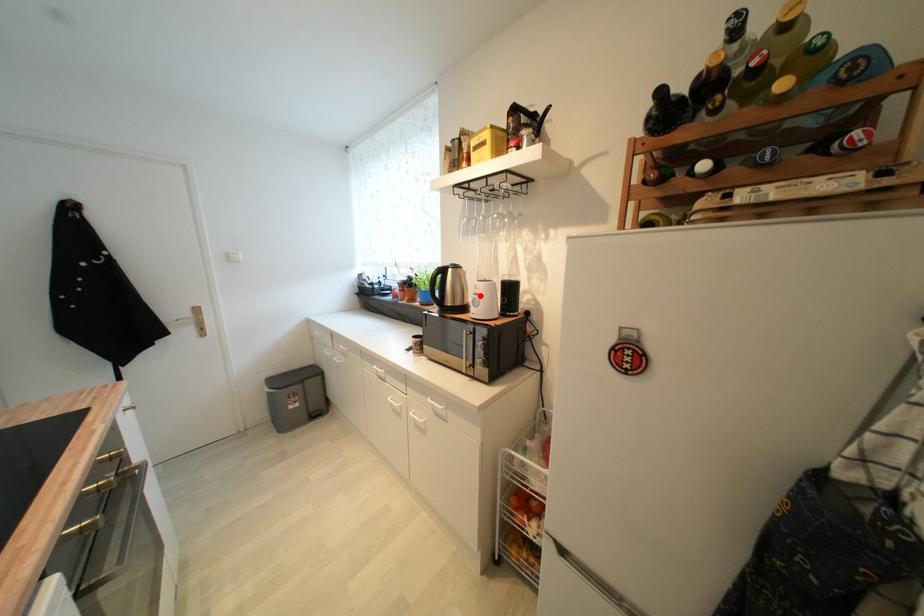
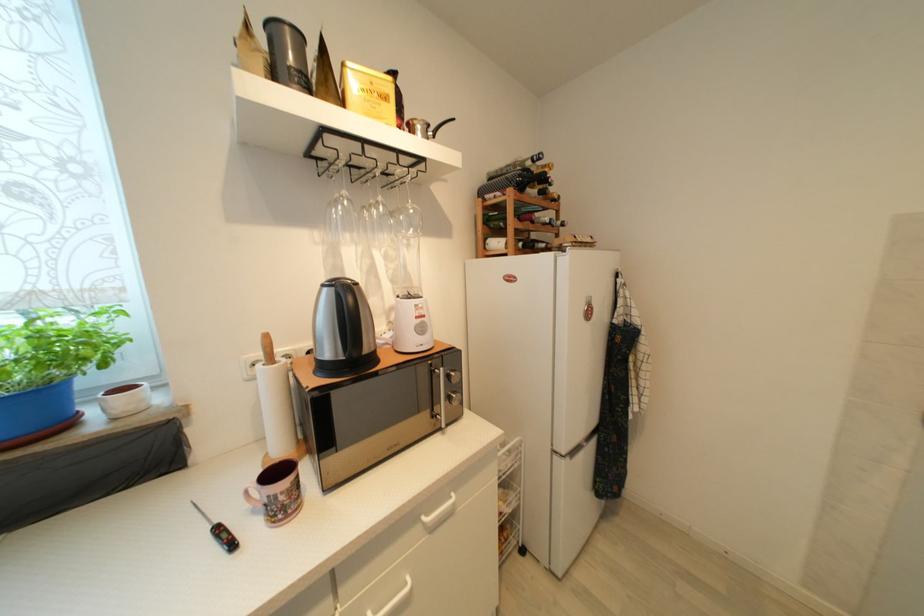
In the second image, find the point that corresponds to the highlighted location in the first image.

(421, 320)